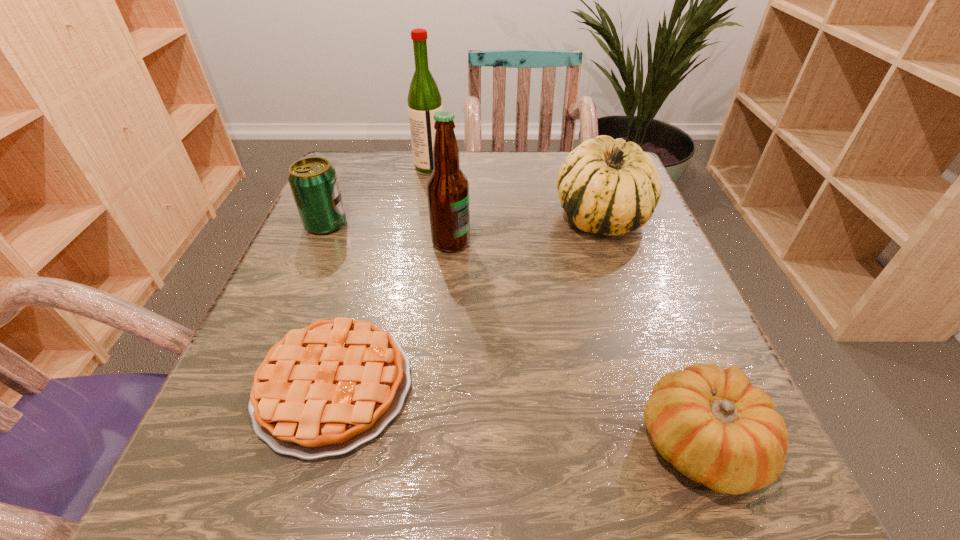
The image size is (960, 540). Identify the location of the tallest object. (424, 100).

Where is `the farthest object`? the farthest object is located at coordinates (424, 100).

Locate an element on the screen. The image size is (960, 540). beer bottle is located at coordinates (447, 187).

In order to click on the farther gourd in this screenshot , I will do `click(607, 186)`.

This screenshot has width=960, height=540. I want to click on the taller gourd, so click(x=607, y=186).

I want to click on the fourth tallest object, so click(x=313, y=181).

I want to click on the shorter gourd, so click(715, 427).

Where is `the fifth tallest object`? the fifth tallest object is located at coordinates (715, 427).

Locate an element on the screen. pie is located at coordinates (323, 390).

Where is `vacant area situated on the label of the farthest object`? vacant area situated on the label of the farthest object is located at coordinates (466, 166).